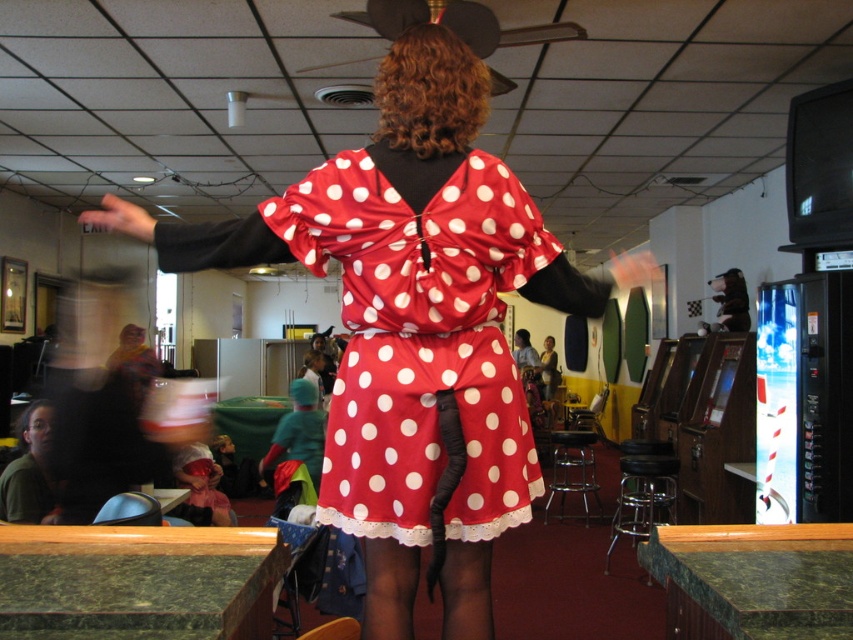
You are a photographer at an indoor event venue. You need to capture a photo of the silky red dress at center and the green matte shirt at lower left. Based on their positions, which object is closer to the ceiling?

The silky red dress at center is closer to the ceiling because it is positioned above the green matte shirt at lower left.

From the picture: You are an interior designer planning to place a new sofa in the indoor arcade venue. The sofa will be positioned at coordinates point 0.5, 0.5. Will the silky red dress at center interfere with the sofa placement?

The silky red dress at center is located at point (x=410, y=326), which is very close to the desired sofa placement at (x=426, y=320). The exact coordinates suggest minimal interference, so the sofa can be placed there without significant obstruction.

You are at an arcade and want to take a photo of both the silky red dress at center and the green matte shirt at lower left. Which object should you focus on first if you want to capture them both in the same frame without moving your camera?

You should focus on the silky red dress at center first because it is positioned to the right of the green matte shirt at lower left, so by centering your camera on the dress, you can adjust the frame to include both objects without moving the camera.